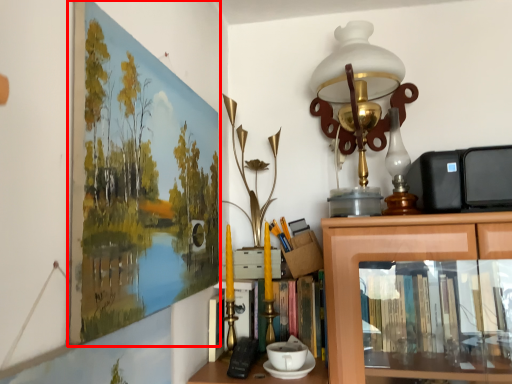
Question: Where is picture frame (annotated by the red box) located in relation to table lamp in the image?

Choices:
 (A) right
 (B) left

Answer: (B)